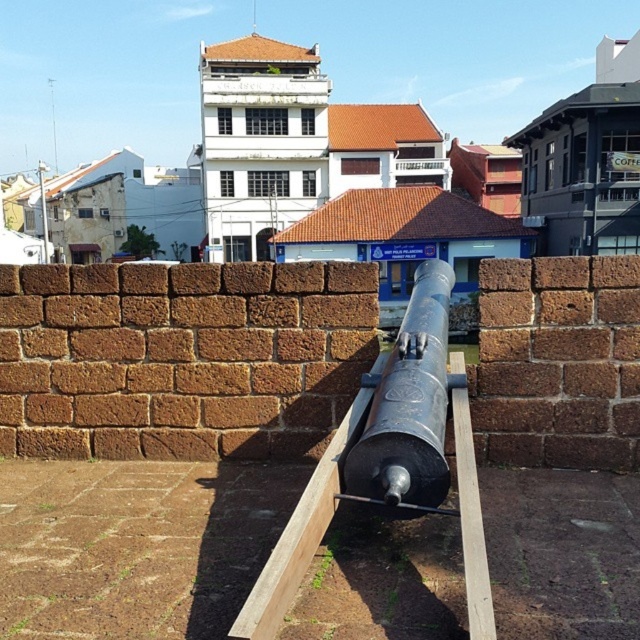
You are standing at the point with coordinates (388, 461) in the image. What object are you directly facing?

The point at coordinates (388, 461) corresponds to the black metal cannon at center, so you are directly facing the black metal cannon at center.

Consider the image. You are an art student analyzing the image. You notice two cannons, the black metal cannon at center and the matte black cannon at center. Which cannon is located to the left of the other?

The black metal cannon at center is positioned on the left side of matte black cannon at center.

You are an art conservator tasked with moving the cannons from the wooden platform to a storage facility. The storage has a weight limit of 500 kg per crate. You know the black metal cannon at center weighs 600 kg and the matte black cannon at center weighs 400 kg. Can both cannons be safely transported in separate crates without exceeding the weight limit?

The black metal cannon at center weighs 600 kg, which exceeds the 500 kg weight limit, while the matte black cannon at center at 400 kg is under the limit. Therefore, only the matte black cannon at center can be safely transported in a single crate without exceeding the weight limit. The black metal cannon at center would require a different arrangement or a crate with a higher capacity.